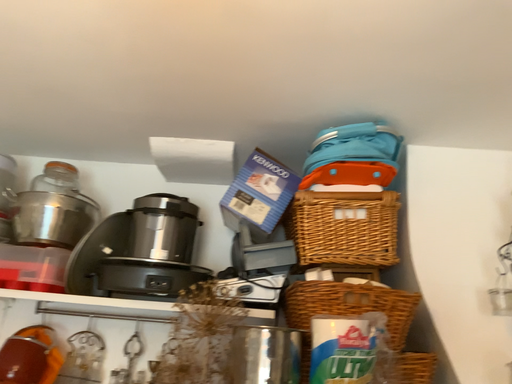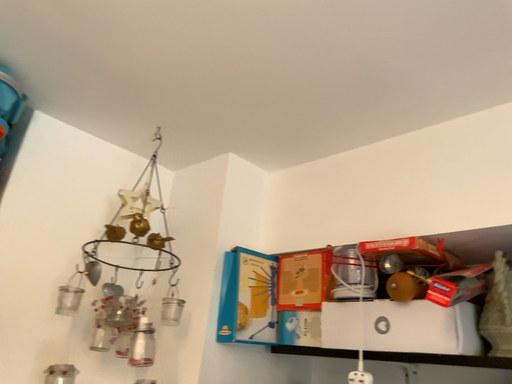
Question: How did the camera likely rotate when shooting the video?

Choices:
 (A) rotated downward
 (B) rotated upward

Answer: (A)